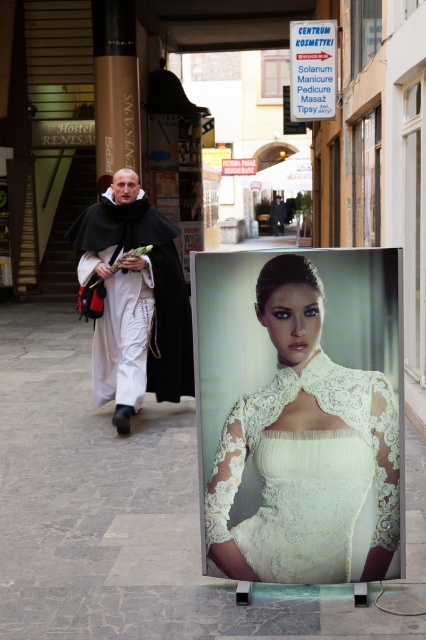
You are a photographer trying to capture a clear shot of the white woolen robe at center without the white lace billboard at center obstructing it. Is this possible given their current positions?

The white woolen robe at center is in front of the white lace billboard at center, so it would block the view of the billboard. To capture the billboard clearly, you would need to position yourself so that the robe is not between you and the billboard.

You are a delivery person who needs to place a small package on the gray stone pavement at center. However, there is a white woolen robe at center in the way. Can you place the package there without moving the robe?

The gray stone pavement at center has a larger size compared to the white woolen robe at center, so there is enough space to place the package without moving the robe.